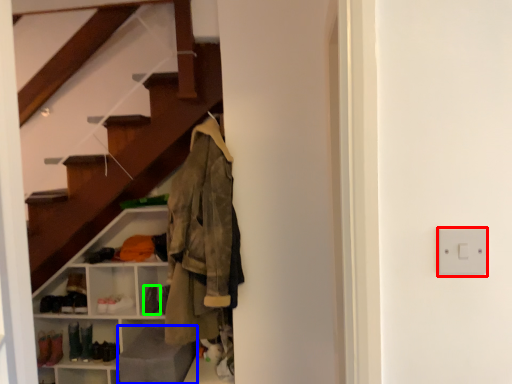
Question: Which object is positioned farthest from electric outlet (highlighted by a red box)? Select from gray (highlighted by a blue box) and shoe (highlighted by a green box).

Choices:
 (A) gray
 (B) shoe

Answer: (B)